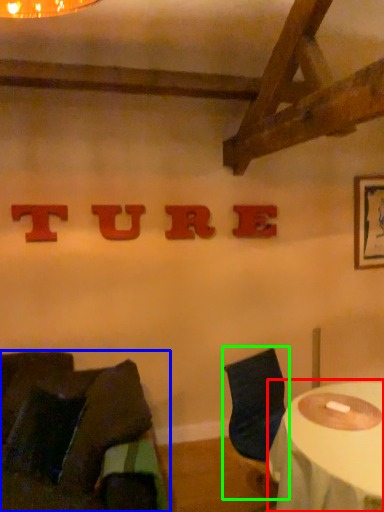
Question: Considering the real-world distances, which object is closest to table (highlighted by a red box)? chair (highlighted by a blue box) or chair (highlighted by a green box).

Choices:
 (A) chair
 (B) chair

Answer: (B)